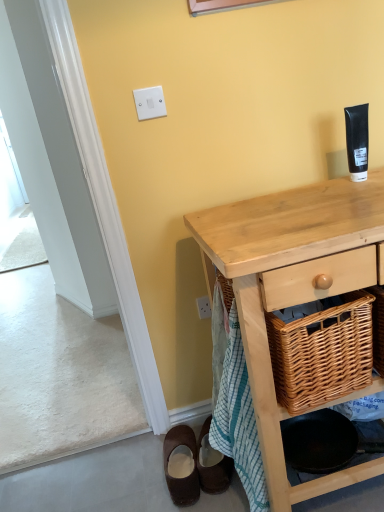
Question: Is brown suede shoes at lower left, placed as the 2th footwear when sorted from left to right, positioned with its back to brown suede mule at lower left, the 2th footwear when ordered from right to left?

Choices:
 (A) no
 (B) yes

Answer: (A)

Question: Can you confirm if brown suede shoes at lower left, the 1th footwear positioned from the right, is bigger than brown suede mule at lower left, the 2th footwear when ordered from right to left?

Choices:
 (A) no
 (B) yes

Answer: (A)

Question: Is brown suede mule at lower left, arranged as the 1th footwear when viewed from the left, completely or partially inside brown suede shoes at lower left, the 1th footwear positioned from the right?

Choices:
 (A) no
 (B) yes

Answer: (A)

Question: From a real-world perspective, does brown suede shoes at lower left, the 1th footwear positioned from the right, stand above brown suede mule at lower left, arranged as the 1th footwear when viewed from the left?

Choices:
 (A) no
 (B) yes

Answer: (B)

Question: From a real-world perspective, does brown suede shoes at lower left, the 1th footwear positioned from the right, sit lower than brown suede mule at lower left, the 2th footwear when ordered from right to left?

Choices:
 (A) no
 (B) yes

Answer: (A)

Question: Relative to brown suede shoes at lower left, the 1th footwear positioned from the right, is white plastic light switch at upper center in front or behind?

Choices:
 (A) front
 (B) behind

Answer: (A)

Question: From their relative heights in the image, would you say white plastic light switch at upper center is taller or shorter than brown suede shoes at lower left, the 1th footwear positioned from the right?

Choices:
 (A) tall
 (B) short

Answer: (B)

Question: From a real-world perspective, is white plastic light switch at upper center positioned above or below brown suede shoes at lower left, the 1th footwear positioned from the right?

Choices:
 (A) above
 (B) below

Answer: (A)

Question: Do you think white plastic light switch at upper center is within brown suede shoes at lower left, the 1th footwear positioned from the right, or outside of it?

Choices:
 (A) outside
 (B) inside

Answer: (A)

Question: Would you say natural wood desk at center is inside or outside woven wood picnic basket at lower right?

Choices:
 (A) outside
 (B) inside

Answer: (A)

Question: Considering their positions, is natural wood desk at center located in front of or behind woven wood picnic basket at lower right?

Choices:
 (A) behind
 (B) front

Answer: (B)

Question: Considering the positions of natural wood desk at center and woven wood picnic basket at lower right in the image, is natural wood desk at center taller or shorter than woven wood picnic basket at lower right?

Choices:
 (A) tall
 (B) short

Answer: (A)

Question: Considering the positions of natural wood desk at center and woven wood picnic basket at lower right in the image, is natural wood desk at center bigger or smaller than woven wood picnic basket at lower right?

Choices:
 (A) small
 (B) big

Answer: (B)

Question: From a real-world perspective, relative to woven wood picnic basket at lower right, is brown suede shoes at lower left, placed as the 2th footwear when sorted from left to right, vertically above or below?

Choices:
 (A) above
 (B) below

Answer: (B)

Question: Is brown suede shoes at lower left, the 1th footwear positioned from the right, in front of or behind woven wood picnic basket at lower right in the image?

Choices:
 (A) front
 (B) behind

Answer: (B)